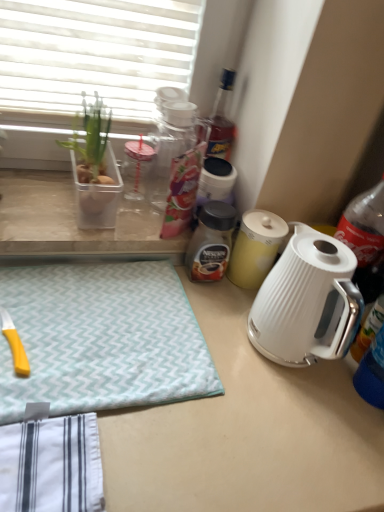
Where is `free point in front of yellow matte canister at center`? The width and height of the screenshot is (384, 512). free point in front of yellow matte canister at center is located at coordinates click(238, 325).